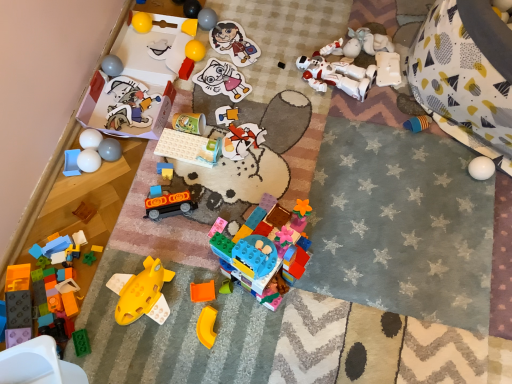
Image resolution: width=512 pixels, height=384 pixels. Find the location of `free space that is in between matte plastic blocks at center, which appears as the fifteenth toy when viewed from the right, and black plastic train at center, the 14th toy from the right`. free space that is in between matte plastic blocks at center, which appears as the fifteenth toy when viewed from the right, and black plastic train at center, the 14th toy from the right is located at coordinates (170, 186).